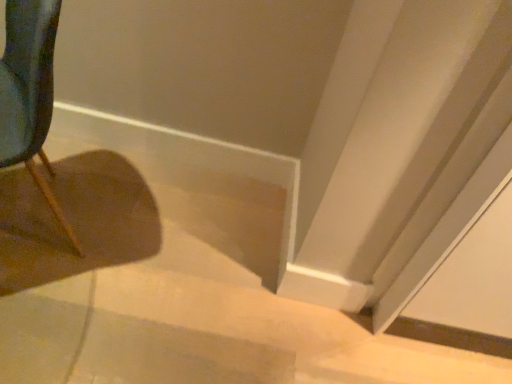
The image size is (512, 384). I want to click on vacant region under matte brown chair at left (from a real-world perspective), so click(39, 218).